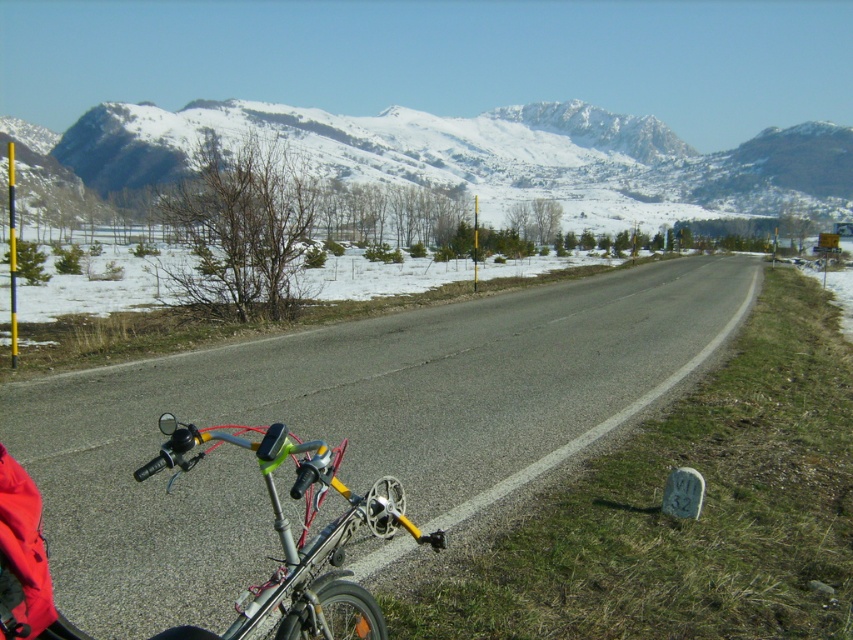
You are navigating a drone along the road in the winter landscape scene. You need to fly from point A to point B. If point A is at coordinates point (785, 204) and point B is at coordinates point (267, 451), which direction should you fly to reach point B from point A?

To reach point B from point A, you should fly forward because point A is behind point B according to their coordinates. Since point (785, 204) is behind point (267, 451), moving towards point B would involve flying forward along the road.

You are a hiker planning to take a photo of the snowy rocky mountain at upper center and the silver metallic bicycle handlebars at lower left. Which object should you focus on first if you want to capture both in a single frame without moving your camera?

The snowy rocky mountain at upper center is wider than the silver metallic bicycle handlebars at lower left, so you should focus on the snowy rocky mountain at upper center first to ensure it fits in the frame.

You are a hiker who wants to take a photo of the snowy rocky mountain at upper center and the silver metallic bicycle handlebars at lower left. Which object should you focus on first if you want to capture both in a single frame without moving your camera?

The snowy rocky mountain at upper center is positioned on the left side of the silver metallic bicycle handlebars at lower left, so you should focus on the snowy rocky mountain at upper center first to ensure both are in frame.